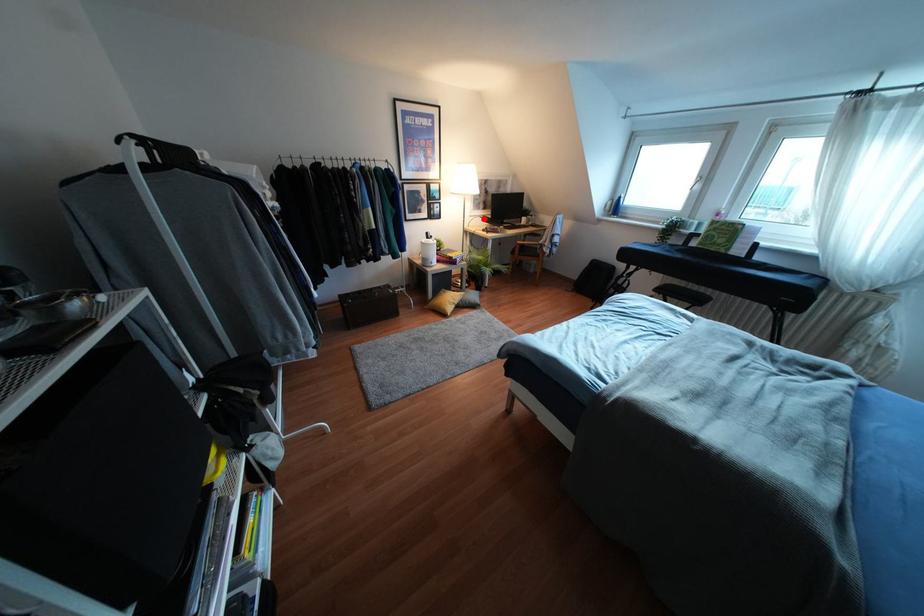
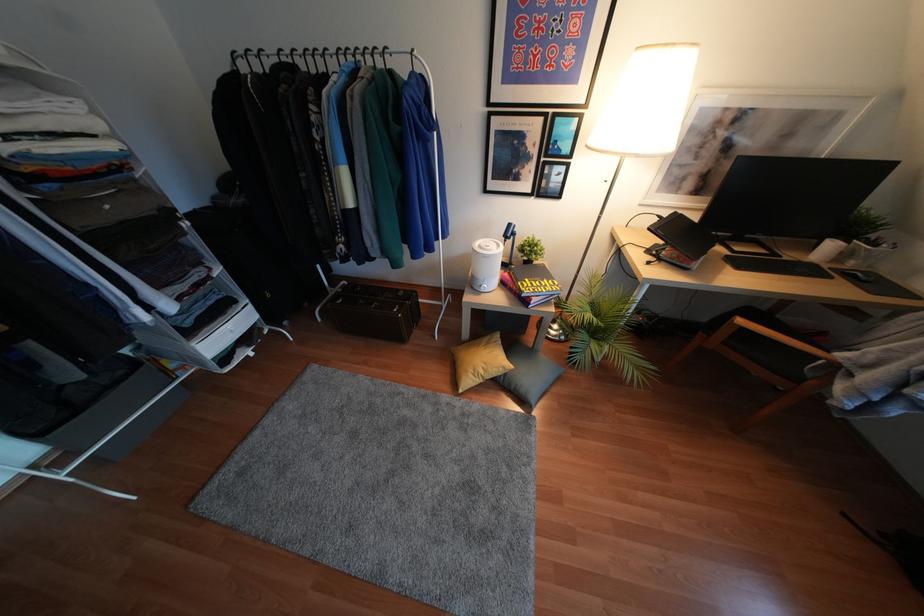
Locate, in the second image, the point that corresponds to the highlighted location in the first image.

(666, 224)